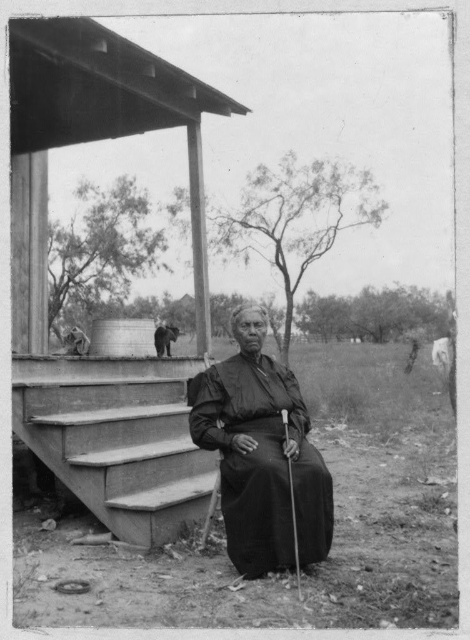
Is point (94, 492) closer to viewer compared to point (156, 348)?

Yes, it is in front of point (156, 348).

Is smooth concrete stairs at center closer to camera compared to smooth gray cat at upper left?

Yes, smooth concrete stairs at center is closer to the viewer.

Does point (60, 422) lie behind point (164, 330)?

No, it is in front of (164, 330).

Image resolution: width=470 pixels, height=640 pixels. I want to click on smooth concrete stairs at center, so click(117, 438).

Is point (188, 448) closer to camera compared to point (157, 346)?

Yes, point (188, 448) is closer to viewer.

Looking at this image, measure the distance between wooden gazebo at upper center and smooth gray cat at upper left.

wooden gazebo at upper center and smooth gray cat at upper left are 5.41 meters apart from each other.

Is point (46, 362) positioned before point (156, 326)?

Yes, point (46, 362) is closer to viewer.

Where is `wooden gazebo at upper center`? The image size is (470, 640). wooden gazebo at upper center is located at coordinates (46, 253).

Does smooth concrete stairs at center have a lesser width compared to black matte dress at center?

No.

Is point (174, 364) closer to camera compared to point (194, 435)?

No, it is behind (194, 435).

What do you see at coordinates (117, 438) in the screenshot?
I see `smooth concrete stairs at center` at bounding box center [117, 438].

At what (x,y) coordinates should I click in order to perform the action: click on smooth concrete stairs at center. Please return your answer as a coordinate pair (x, y). This screenshot has width=470, height=640. Looking at the image, I should click on (117, 438).